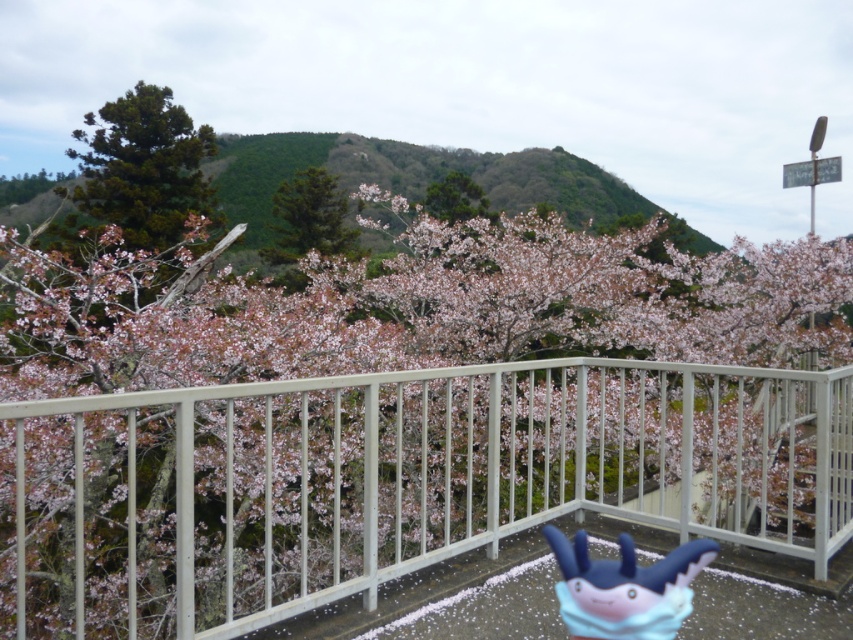
You are standing on the balcony looking at the scene. There is a point at coordinate (392, 481). Which object is this point located on?

The point at coordinate (392, 481) is located on the white metal railing at center.

You are standing on the balcony and want to pick up the blue rubber toy at center. The green matte tree at center is in your way. Can you walk around the tree to reach the toy?

The blue rubber toy at center and the green matte tree at center are 15.73 meters apart. Since the distance between them is quite large, you can easily walk around the green matte tree at center to reach the blue rubber toy at center.